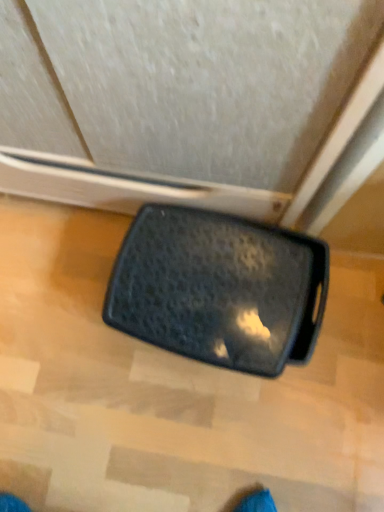
At what (x,y) coordinates should I click in order to perform the action: click on vacant region to the left of black rubber mat at center. Please return your answer as a coordinate pair (x, y). Image resolution: width=384 pixels, height=512 pixels. Looking at the image, I should click on (56, 320).